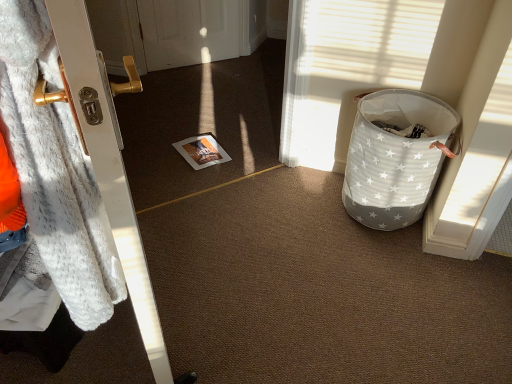
At what (x,y) coordinates should I click in order to perform the action: click on blank area beneath white fur coat at left (from a real-world perspective). Please return your answer as a coordinate pair (x, y). Looking at the image, I should click on (160, 300).